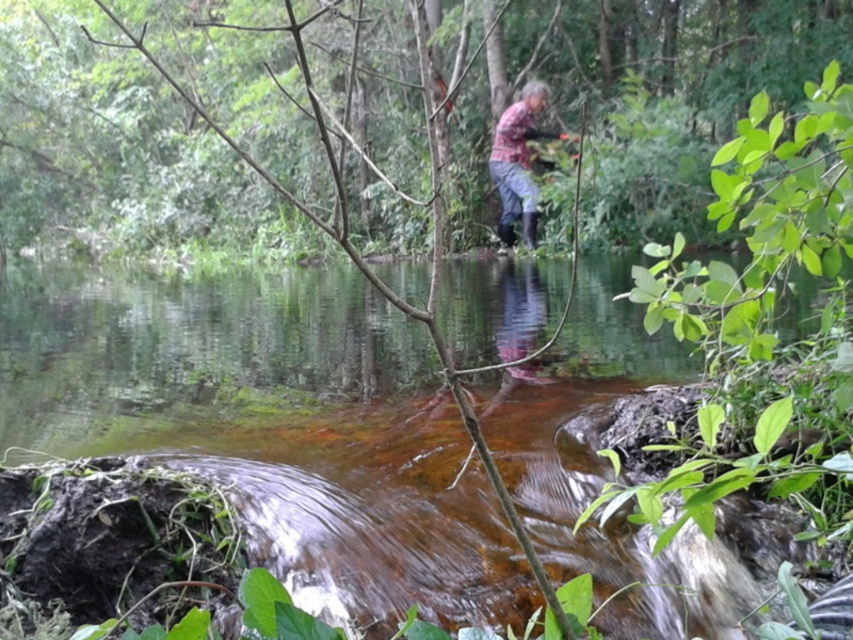
You are a hiker who wants to cross the stream safely. You notice the brown muddy water at center and the plaid fabric shirt at center. Which object is closer to the left side of the stream?

The brown muddy water at center is positioned on the left side of plaid fabric shirt at center, so it is closer to the left side of the stream.

You are a hiker carrying a backpack weighing 20 kilograms. You want to cross the brown muddy water at center to reach the other side. Considering the water depth and your load, do you think it is safe to proceed?

The brown muddy water at center is 1.95 meters away from you, but the depth of the water is not specified. It is unsafe to proceed without knowing the depth of the water and how it might affect your ability to cross with the heavy backpack.